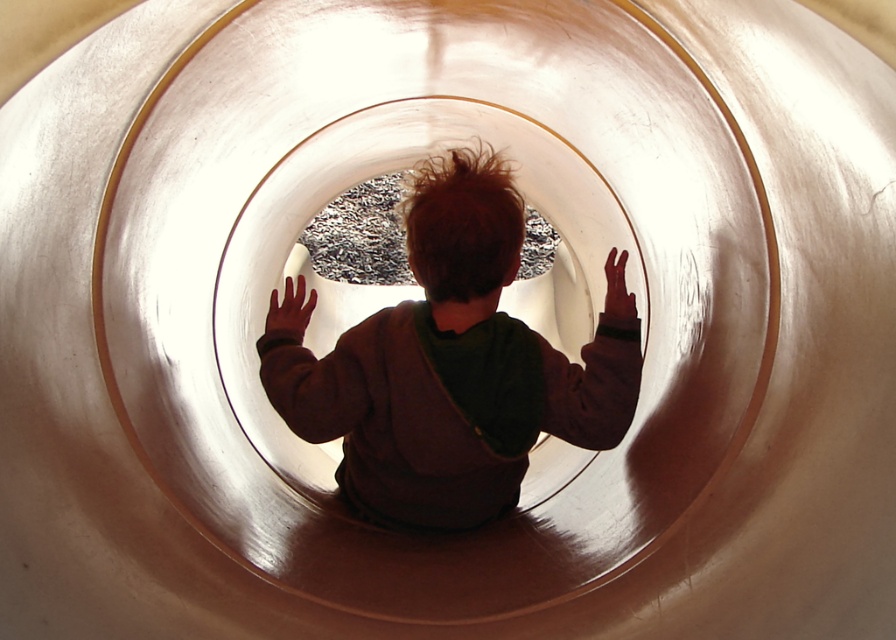
Question: Which of the following is the closest to the observer?

Choices:
 (A) matte brown hoodie at center
 (B) brown leather hand at center

Answer: (A)

Question: Does matte brown hoodie at center appear under matte brown hand at center?

Choices:
 (A) no
 (B) yes

Answer: (B)

Question: Is matte brown hoodie at center closer to the viewer compared to matte brown hand at center?

Choices:
 (A) no
 (B) yes

Answer: (B)

Question: Can you confirm if matte brown hoodie at center is wider than matte brown hand at center?

Choices:
 (A) no
 (B) yes

Answer: (B)

Question: Which point is closer to the camera?

Choices:
 (A) (464, 275)
 (B) (300, 326)

Answer: (A)

Question: Which point is farther from the camera taking this photo?

Choices:
 (A) (277, 328)
 (B) (382, 458)

Answer: (A)